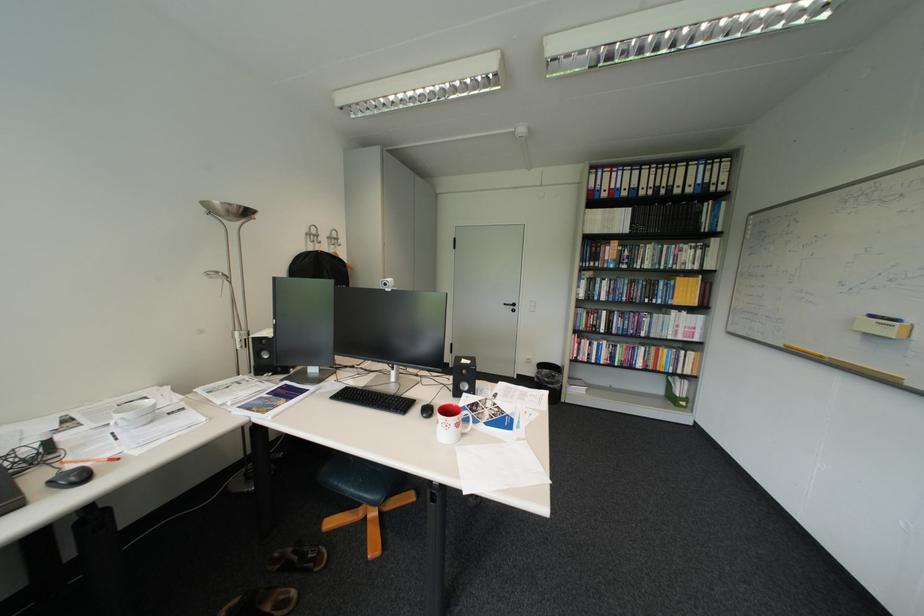
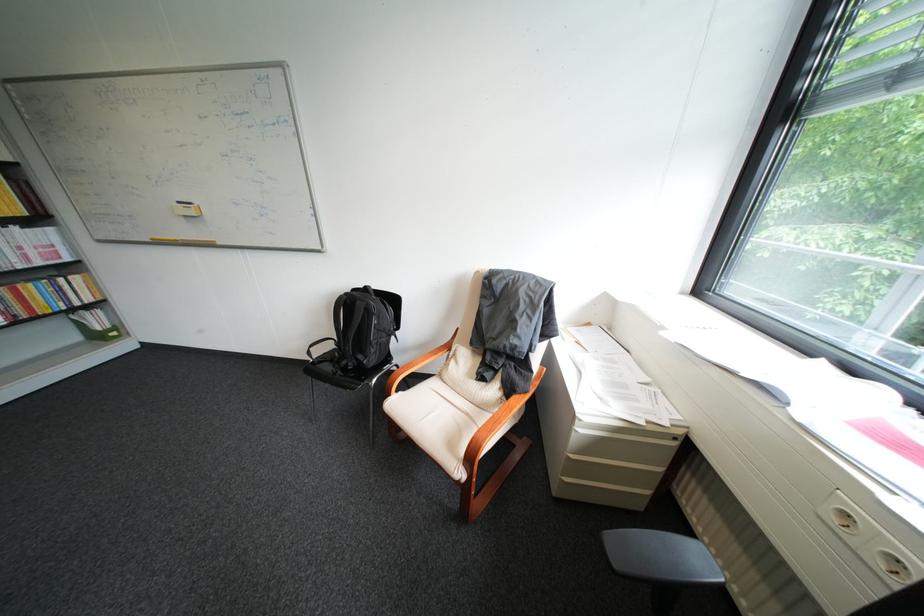
First-person continuous shooting, in which direction is the camera rotating?

The rotation direction of the camera is right-down.